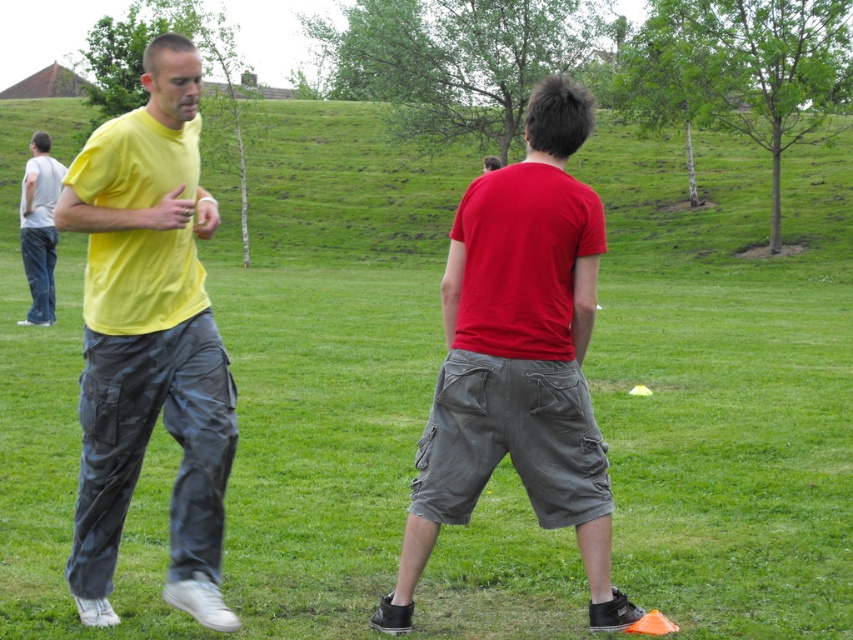
Question: Can you confirm if matte yellow t-shirt at left is bigger than matte red t-shirt at center?

Choices:
 (A) yes
 (B) no

Answer: (B)

Question: Which point is farther to the camera?

Choices:
 (A) (421, 524)
 (B) (181, 483)

Answer: (A)

Question: Does matte yellow t-shirt at left have a larger size compared to matte red t-shirt at center?

Choices:
 (A) no
 (B) yes

Answer: (A)

Question: Can you confirm if matte yellow t-shirt at left is positioned to the left of denim jeans at left?

Choices:
 (A) no
 (B) yes

Answer: (A)

Question: Estimate the real-world distances between objects in this image. Which object is farther from the denim jeans at left?

Choices:
 (A) matte red t-shirt at center
 (B) matte yellow t-shirt at left

Answer: (A)

Question: Which of the following is the closest to the observer?

Choices:
 (A) matte red t-shirt at center
 (B) matte yellow t-shirt at left
 (C) denim jeans at left

Answer: (B)